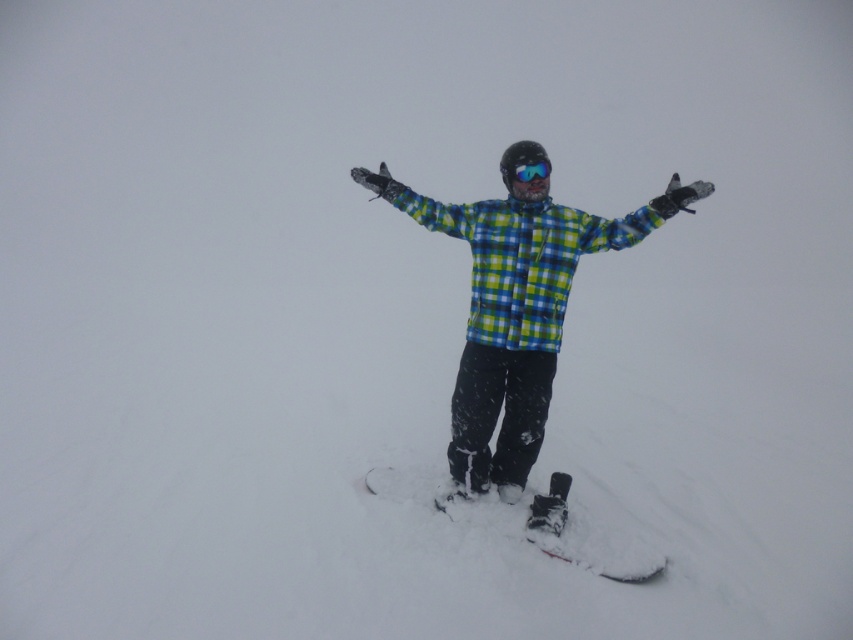
Between point (544, 348) and point (537, 164), which one is positioned in front?

Positioned in front is point (537, 164).

Does point (468, 484) lie behind point (515, 166)?

Yes.

Locate an element on the screen. checkered fabric snowboarder at center is located at coordinates (515, 307).

Who is taller, black matte snowboard at center or blue reflective lens goggles at center?

Standing taller between the two is black matte snowboard at center.

Who is shorter, black matte snowboard at center or blue reflective lens goggles at center?

Standing shorter between the two is blue reflective lens goggles at center.

Is point (560, 552) behind point (503, 170)?

No, it is in front of (503, 170).

The image size is (853, 640). Identify the location of black matte snowboard at center. [527, 520].

Does checkered fabric snowboarder at center appear under black matte snowboard at center?

No, checkered fabric snowboarder at center is not below black matte snowboard at center.

This screenshot has width=853, height=640. Identify the location of checkered fabric snowboarder at center. (515, 307).